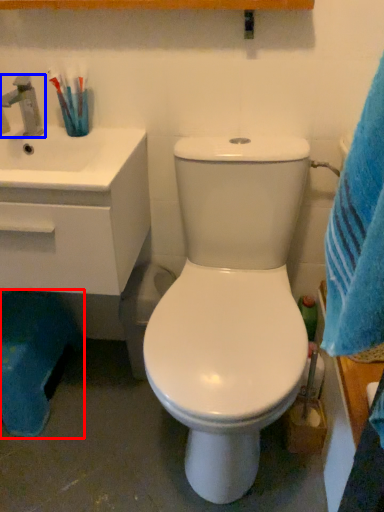
Question: Which object is further to the camera taking this photo, potty (highlighted by a red box) or tap (highlighted by a blue box)?

Choices:
 (A) potty
 (B) tap

Answer: (A)